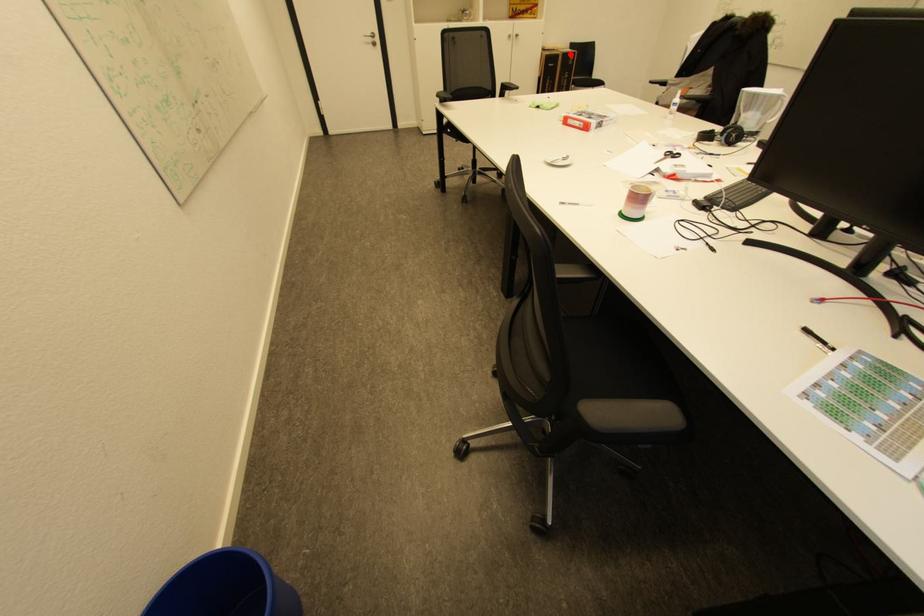
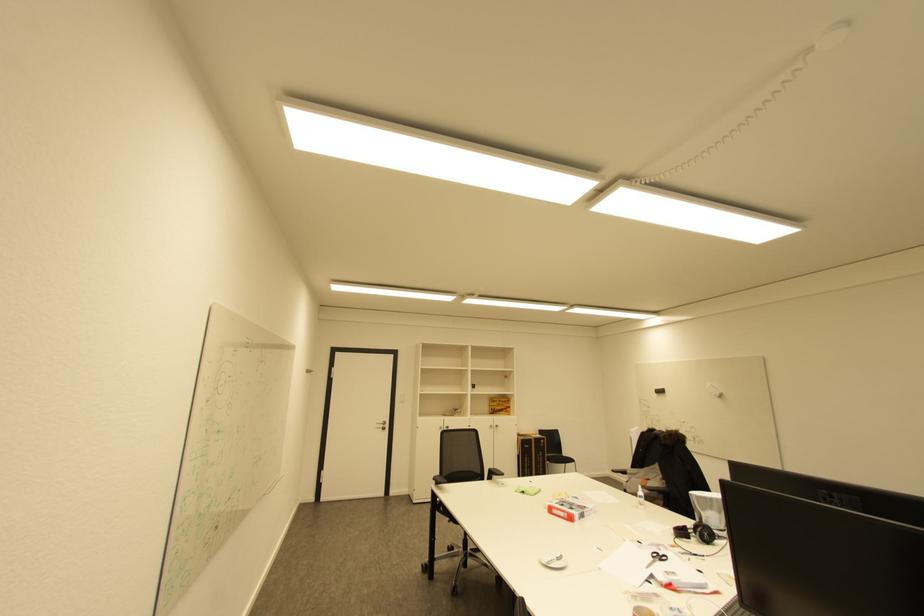
Question: I am providing you with two images of the same scene from different viewpoints. Image1 has a red point marked. In image2, the corresponding 3D location appears at what relative position? Reply with the corresponding letter.

Choices:
 (A) Closer
 (B) Farther

Answer: (B)